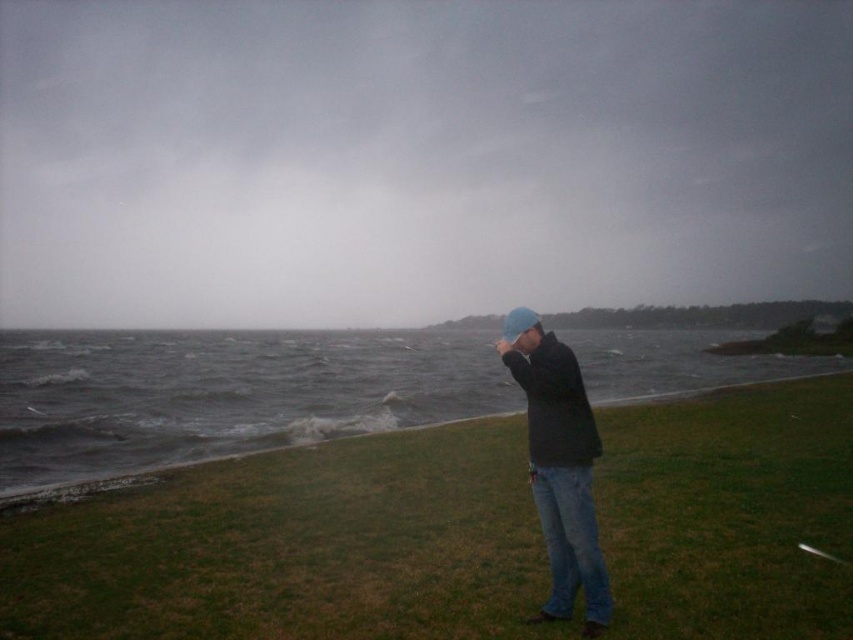
Question: Among these objects, which one is farthest from the camera?

Choices:
 (A) blue knit cap at center
 (B) gray water at lower left

Answer: (B)

Question: Is gray water at lower left to the left of blue knit cap at center from the viewer's perspective?

Choices:
 (A) yes
 (B) no

Answer: (A)

Question: Which object appears farthest from the camera in this image?

Choices:
 (A) green grass at lower right
 (B) gray water at lower left
 (C) blue knit cap at center

Answer: (B)

Question: Can you confirm if green grass at lower right is wider than gray water at lower left?

Choices:
 (A) no
 (B) yes

Answer: (A)

Question: Which object is closer to the camera taking this photo?

Choices:
 (A) green grass at lower right
 (B) blue knit cap at center

Answer: (A)

Question: Does green grass at lower right appear over gray water at lower left?

Choices:
 (A) no
 (B) yes

Answer: (B)